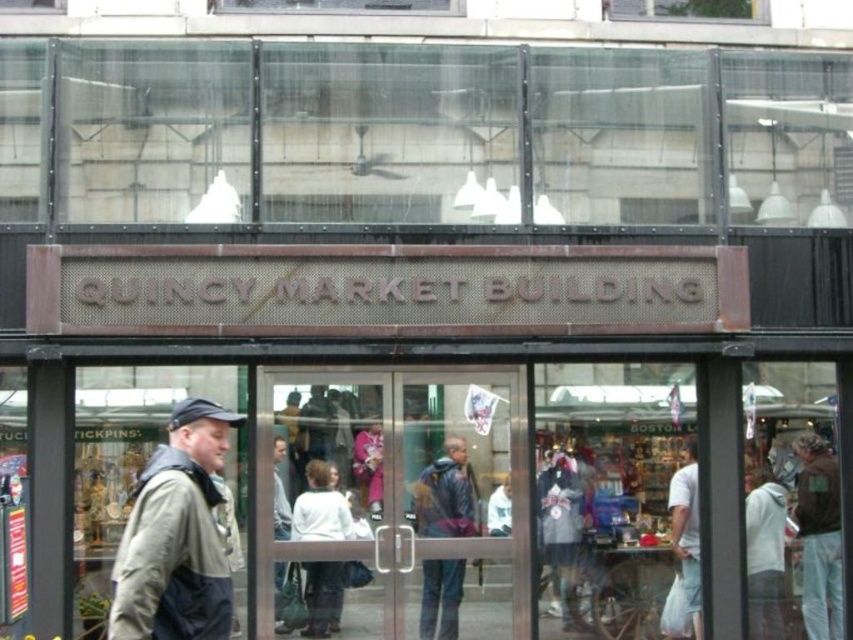
Question: Which point is closer to the camera?

Choices:
 (A) pyautogui.click(x=817, y=573)
 (B) pyautogui.click(x=221, y=609)
 (C) pyautogui.click(x=352, y=604)

Answer: (B)

Question: From the image, what is the correct spatial relationship of light brown leather jacket at right in relation to matte blue jacket at center?

Choices:
 (A) left
 (B) right

Answer: (B)

Question: Which point appears farthest from the camera in this image?

Choices:
 (A) (509, 452)
 (B) (169, 435)
 (C) (692, 440)

Answer: (C)

Question: Does transparent glass door at center appear on the left side of khaki fabric jacket at left?

Choices:
 (A) no
 (B) yes

Answer: (A)

Question: Is khaki fabric jacket at left smaller than light brown leather jacket at right?

Choices:
 (A) yes
 (B) no

Answer: (B)

Question: Which point appears closest to the camera in this image?

Choices:
 (A) (679, 493)
 (B) (819, 573)
 (C) (125, 564)
 (D) (462, 416)

Answer: (C)